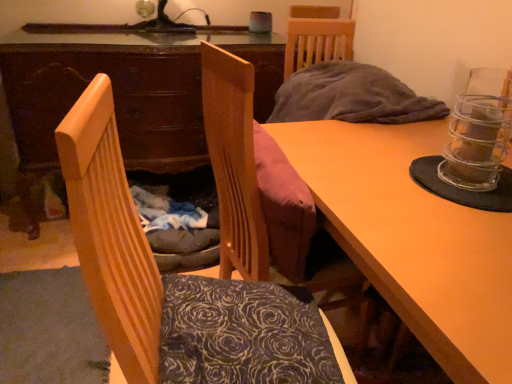
Describe the element at coordinates (242, 334) in the screenshot. I see `dark floral fabric pillow at center` at that location.

Identify the location of wooden chair at left, which ranks as the second chair in back-to-front order. The width and height of the screenshot is (512, 384). (176, 284).

The image size is (512, 384). Describe the element at coordinates (176, 284) in the screenshot. I see `wooden chair at left, marked as the 1th chair in a front-to-back arrangement` at that location.

Identify the location of wooden desk at center. (123, 92).

In order to face velvet pink cushion at center, the second chair from the front, should I rotate leftwards or rightwards?

Turn right by 3.098 degrees to look at velvet pink cushion at center, the second chair from the front.

Find the location of a particular element. The width and height of the screenshot is (512, 384). wooden table at center is located at coordinates (413, 239).

The width and height of the screenshot is (512, 384). In order to click on dark floral fabric pillow at center in this screenshot , I will do `click(242, 334)`.

From the image's perspective, is dark floral fabric pillow at center positioned above or below wooden table at center?

Clearly, from the image's perspective, dark floral fabric pillow at center is below wooden table at center.

How different are the orientations of dark floral fabric pillow at center and wooden table at center in degrees?

dark floral fabric pillow at center and wooden table at center are facing 75.7 degrees away from each other.

At what (x,y) coordinates should I click in order to perform the action: click on table above the dark floral fabric pillow at center (from the image's perspective). Please return your answer as a coordinate pair (x, y). Looking at the image, I should click on (413, 239).

In terms of height, does wooden desk at center look taller or shorter compared to wooden chair at left, marked as the 1th chair in a front-to-back arrangement?

wooden desk at center is taller than wooden chair at left, marked as the 1th chair in a front-to-back arrangement.

Would you consider wooden desk at center to be distant from wooden chair at left, marked as the 1th chair in a front-to-back arrangement?

Yes, wooden desk at center is far from wooden chair at left, marked as the 1th chair in a front-to-back arrangement.

Which is in front, point (270, 74) or point (127, 326)?

Positioned in front is point (127, 326).

How distant is wooden desk at center from wooden chair at left, which ranks as the second chair in back-to-front order?

wooden desk at center and wooden chair at left, which ranks as the second chair in back-to-front order, are 1.29 meters apart from each other.

Does point (433, 259) come in front of point (200, 344)?

Yes.

What's the angular difference between wooden table at center and dark floral fabric pillow at center's facing directions?

They differ by 75.7 degrees in their facing directions.

Between wooden table at center and dark floral fabric pillow at center, which one has smaller width?

dark floral fabric pillow at center.

Where is `table below the dark floral fabric pillow at center (from a real-world perspective)`? The height and width of the screenshot is (384, 512). table below the dark floral fabric pillow at center (from a real-world perspective) is located at coordinates [413, 239].

Image resolution: width=512 pixels, height=384 pixels. Identify the location of the 1st chair located above the wooden table at center (from a real-world perspective). (176, 284).

Which of these two, wooden table at center or wooden chair at left, which ranks as the second chair in back-to-front order, stands shorter?

With less height is wooden table at center.

Can you confirm if wooden table at center is thinner than wooden chair at left, marked as the 1th chair in a front-to-back arrangement?

Incorrect, the width of wooden table at center is not less than that of wooden chair at left, marked as the 1th chair in a front-to-back arrangement.

Does point (217, 116) appear closer or farther from the camera than point (195, 167)?

Point (217, 116) is closer to the camera than point (195, 167).

In the scene shown: From the image's perspective, is velvet pink cushion at center, the second chair from the front, located above wooden desk at center?

No, from the image's perspective, velvet pink cushion at center, the second chair from the front, is not above wooden desk at center.

Considering the sizes of objects velvet pink cushion at center, placed as the 1th chair when sorted from back to front, and wooden desk at center in the image provided, who is smaller, velvet pink cushion at center, placed as the 1th chair when sorted from back to front, or wooden desk at center?

velvet pink cushion at center, placed as the 1th chair when sorted from back to front, is smaller.

In terms of width, does velvet pink cushion at center, placed as the 1th chair when sorted from back to front, look wider or thinner when compared to wooden desk at center?

velvet pink cushion at center, placed as the 1th chair when sorted from back to front, is thinner than wooden desk at center.

Where is `desk on the left of wooden table at center`? desk on the left of wooden table at center is located at coordinates (123, 92).

In the scene shown: Can you see wooden desk at center touching wooden table at center?

No, wooden desk at center is not with wooden table at center.

Which of these two, wooden desk at center or wooden table at center, stands shorter?

wooden table at center.

Does velvet pink cushion at center, placed as the 1th chair when sorted from back to front, come in front of wooden table at center?

No, it is behind wooden table at center.

Locate an element on the screen. table located on the right of velvet pink cushion at center, placed as the 1th chair when sorted from back to front is located at coordinates (413, 239).

From a real-world perspective, which is physically above, velvet pink cushion at center, the second chair from the front, or wooden table at center?

velvet pink cushion at center, the second chair from the front.

You are a GUI agent. You are given a task and a screenshot of the screen. Output one action in this format:
    pyautogui.click(x=<x>, y=<y>)
    Task: Click on the pillow that appears above the wooden table at center (from a real-world perspective)
    
    Given the screenshot: What is the action you would take?
    pyautogui.click(x=242, y=334)

From the image's perspective, count 2nd chairs downward from the wooden desk at center and point to it. Please provide its 2D coordinates.

[(176, 284)]

Based on the photo, from the image, which object appears to be nearer to dark floral fabric pillow at center, wooden desk at center or velvet pink cushion at center, placed as the 1th chair when sorted from back to front?

velvet pink cushion at center, placed as the 1th chair when sorted from back to front, lies closer to dark floral fabric pillow at center than the other object.

Which object lies further to the anchor point wooden chair at left, which ranks as the second chair in back-to-front order, wooden table at center or dark floral fabric pillow at center?

wooden table at center is positioned further to the anchor wooden chair at left, which ranks as the second chair in back-to-front order.

In the scene shown: Based on their spatial positions, is dark floral fabric pillow at center or wooden chair at left, marked as the 1th chair in a front-to-back arrangement, closer to wooden desk at center?

wooden chair at left, marked as the 1th chair in a front-to-back arrangement.

Looking at the image, which one is located closer to velvet pink cushion at center, the second chair from the front, wooden chair at left, marked as the 1th chair in a front-to-back arrangement, or dark floral fabric pillow at center?

Based on the image, dark floral fabric pillow at center appears to be nearer to velvet pink cushion at center, the second chair from the front.

Looking at the image, which one is located further to velvet pink cushion at center, placed as the 1th chair when sorted from back to front, wooden table at center or wooden desk at center?

wooden desk at center.

When comparing their distances from wooden desk at center, does wooden table at center or dark floral fabric pillow at center seem closer?

wooden table at center is positioned closer to the anchor wooden desk at center.

Looking at the image, which one is located closer to dark floral fabric pillow at center, velvet pink cushion at center, the second chair from the front, or wooden desk at center?

Among the two, velvet pink cushion at center, the second chair from the front, is located nearer to dark floral fabric pillow at center.

Considering their positions, is wooden table at center positioned further to dark floral fabric pillow at center than wooden desk at center?

wooden desk at center.

Locate an element on the screen. table located between wooden chair at left, which ranks as the second chair in back-to-front order, and wooden desk at center in the depth direction is located at coordinates (413, 239).

Where is `pillow between wooden table at center and wooden desk at center along the z-axis`? pillow between wooden table at center and wooden desk at center along the z-axis is located at coordinates (242, 334).

This screenshot has height=384, width=512. In order to click on chair between wooden chair at left, marked as the 1th chair in a front-to-back arrangement, and wooden table at center, in the horizontal direction in this screenshot , I will do `click(234, 162)`.

Find the location of `pillow situated between wooden chair at left, marked as the 1th chair in a front-to-back arrangement, and wooden table at center from left to right`. pillow situated between wooden chair at left, marked as the 1th chair in a front-to-back arrangement, and wooden table at center from left to right is located at coordinates (242, 334).